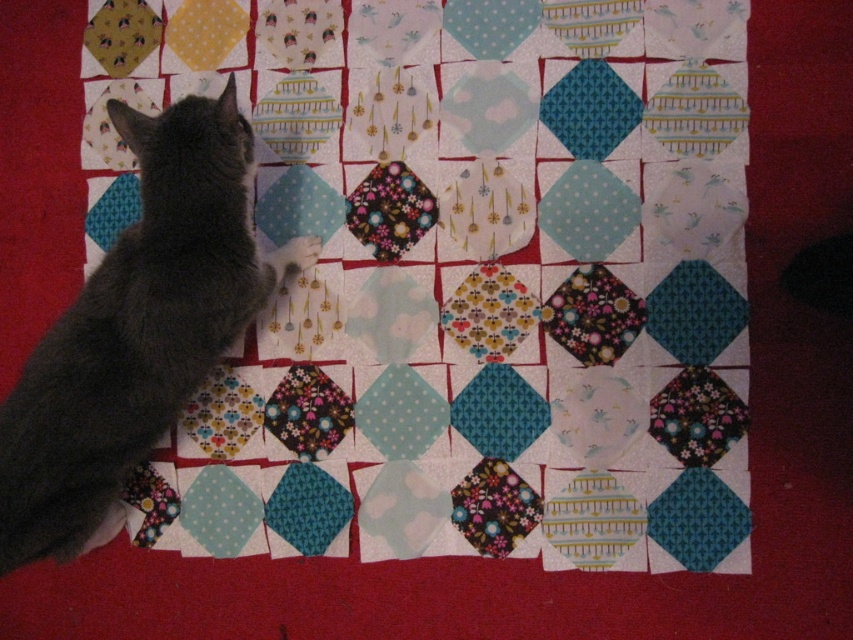
You are standing in front of the image and notice the dark gray fur cat at left. Can you determine if the cat is positioned closer to the bottom or the top of the image based on its coordinates?

The dark gray fur cat at left is located at point 0.158 on the vertical axis, which places it closer to the bottom of the image since lower y values are closer to the bottom.

You are a photographer trying to capture the cat in the image. The cat is sitting on a red surface facing a patchwork quilt. You notice the dark gray fur cat at left and the fluffy gray paw at center. Which object is taller?

The dark gray fur cat at left is taller than the fluffy gray paw at center.